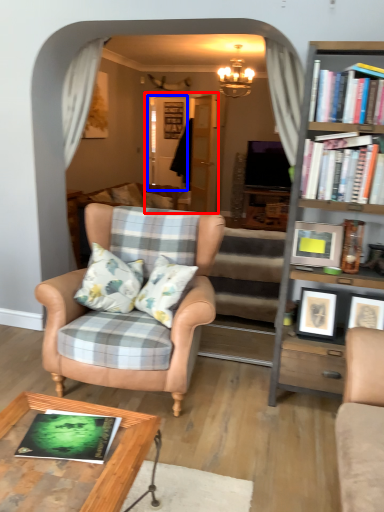
Question: Which of the following is the closest to the observer, glass door (highlighted by a red box) or glass door (highlighted by a blue box)?

Choices:
 (A) glass door
 (B) glass door

Answer: (A)